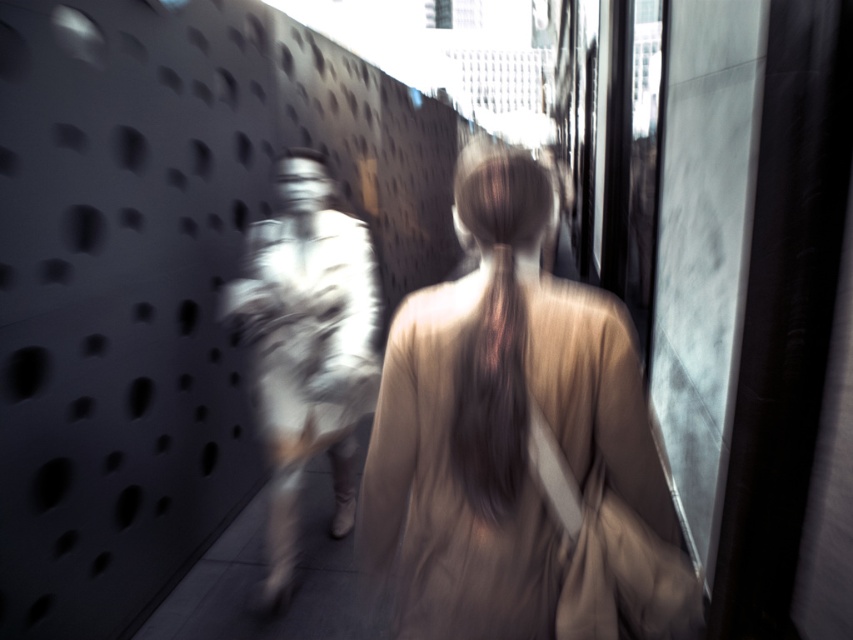
You are a photographer trying to capture a clear shot of the matte beige dress at center and the white fabric dress at center. Since both dresses are moving, you notice that one is closer to the camera than the other. Which dress is more likely to be in focus if you focus on the one farther away?

The white fabric dress at center is more likely to be in focus because the matte beige dress at center is positioned on the right side of it, meaning the white fabric dress at center is closer to the camera.

You are a fashion designer observing the urban scene. You notice two dresses in the center of the image, the matte beige dress at center and the white fabric dress at center. Which dress has a more slender silhouette?

The matte beige dress at center is thinner than the white fabric dress at center, so the matte beige dress at center has a more slender silhouette.

You are a photographer trying to capture a clear shot of both the matte beige dress at center and the white fabric dress at center. The dresses are moving slightly. If your camera has a focus range of 3 feet, will you be able to capture both in focus at the same time?

The matte beige dress at center and white fabric dress at center are 3.72 feet apart from each other. Since the focus range is only 3 feet, the dresses are too far apart to be captured in focus simultaneously.